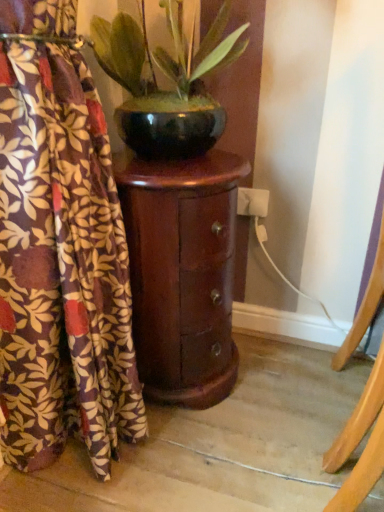
Find the location of a particular element. The height and width of the screenshot is (512, 384). shiny black pot at center is located at coordinates (167, 77).

Image resolution: width=384 pixels, height=512 pixels. What do you see at coordinates (167, 77) in the screenshot?
I see `shiny black pot at center` at bounding box center [167, 77].

What do you see at coordinates (61, 267) in the screenshot?
I see `brown floral fabric at left` at bounding box center [61, 267].

Where is `shiny dark wood cabinet at center`? Image resolution: width=384 pixels, height=512 pixels. shiny dark wood cabinet at center is located at coordinates (182, 273).

Considering the positions of objects shiny dark wood cabinet at center and shiny black pot at center in the image provided, who is more to the left, shiny dark wood cabinet at center or shiny black pot at center?

shiny dark wood cabinet at center is more to the left.

From a real-world perspective, is shiny dark wood cabinet at center above or below shiny black pot at center?

shiny dark wood cabinet at center is below shiny black pot at center.

Between shiny dark wood cabinet at center and shiny black pot at center, which one has larger size?

shiny dark wood cabinet at center is bigger.

From the image's perspective, does shiny dark wood cabinet at center appear higher than shiny black pot at center?

No, from the image's perspective, shiny dark wood cabinet at center is not on top of shiny black pot at center.

Is shiny black pot at center bigger than shiny dark wood cabinet at center?

No.

From the image's perspective, which one is positioned higher, shiny black pot at center or shiny dark wood cabinet at center?

From the image's view, shiny black pot at center is above.

Which object is closer to the camera, shiny black pot at center or shiny dark wood cabinet at center?

Positioned in front is shiny black pot at center.

Based on the photo, is shiny black pot at center positioned far away from shiny dark wood cabinet at center?

No.

Does brown floral fabric at left appear on the right side of shiny black pot at center?

Incorrect, brown floral fabric at left is not on the right side of shiny black pot at center.

Which object is further away from the camera, brown floral fabric at left or shiny black pot at center?

shiny black pot at center is further away from the camera.

From a real-world perspective, is brown floral fabric at left physically located above or below shiny black pot at center?

In terms of real-world spatial position, brown floral fabric at left is below shiny black pot at center.

Does point (59, 228) lie behind point (185, 67)?

No.

Find the location of a particular element. The image size is (384, 512). furniture below the brown floral fabric at left (from the image's perspective) is located at coordinates (182, 273).

From the image's perspective, does brown floral fabric at left appear higher than shiny dark wood cabinet at center?

Indeed, from the image's perspective, brown floral fabric at left is shown above shiny dark wood cabinet at center.

Consider the image. Measure the distance between brown floral fabric at left and shiny dark wood cabinet at center.

7.25 inches.

Is shiny dark wood cabinet at center at the back of brown floral fabric at left?

brown floral fabric at left does not have its back to shiny dark wood cabinet at center.

How many degrees apart are the facing directions of shiny black pot at center and brown floral fabric at left?

2.73 degrees.

Which object is closer to the camera taking this photo, shiny black pot at center or brown floral fabric at left?

brown floral fabric at left is more forward.

Is point (118, 69) less distant than point (112, 428)?

No.

The image size is (384, 512). Identify the location of houseplant located behind the brown floral fabric at left. [x=167, y=77].

Considering the sizes of objects shiny dark wood cabinet at center and brown floral fabric at left in the image provided, who is shorter, shiny dark wood cabinet at center or brown floral fabric at left?

shiny dark wood cabinet at center is shorter.

Are shiny dark wood cabinet at center and brown floral fabric at left located far from each other?

No, shiny dark wood cabinet at center is not far away from brown floral fabric at left.

How different are the orientations of shiny dark wood cabinet at center and brown floral fabric at left in degrees?

The angular difference between shiny dark wood cabinet at center and brown floral fabric at left is 3.88 degrees.

What are the coordinates of `houseplant that is on the right side of shiny dark wood cabinet at center` in the screenshot? It's located at coord(167,77).

The image size is (384, 512). Identify the location of furniture on the left of shiny black pot at center. (182, 273).

When comparing their distances from shiny dark wood cabinet at center, does brown floral fabric at left or shiny black pot at center seem further?

Based on the image, shiny black pot at center appears to be further to shiny dark wood cabinet at center.

Based on the photo, which object lies further to the anchor point brown floral fabric at left, shiny dark wood cabinet at center or shiny black pot at center?

The object further to brown floral fabric at left is shiny black pot at center.

When comparing their distances from shiny black pot at center, does shiny dark wood cabinet at center or brown floral fabric at left seem further?

brown floral fabric at left is positioned further to the anchor shiny black pot at center.

From the image, which object appears to be farther from shiny black pot at center, brown floral fabric at left or shiny dark wood cabinet at center?

brown floral fabric at left lies further to shiny black pot at center than the other object.

Which object lies nearer to the anchor point shiny dark wood cabinet at center, shiny black pot at center or brown floral fabric at left?

The object closer to shiny dark wood cabinet at center is brown floral fabric at left.

From the image, which object appears to be nearer to brown floral fabric at left, shiny black pot at center or shiny dark wood cabinet at center?

The object closer to brown floral fabric at left is shiny dark wood cabinet at center.

Locate an element on the screen. The height and width of the screenshot is (512, 384). curtain between shiny black pot at center and shiny dark wood cabinet at center in the up-down direction is located at coordinates (61, 267).